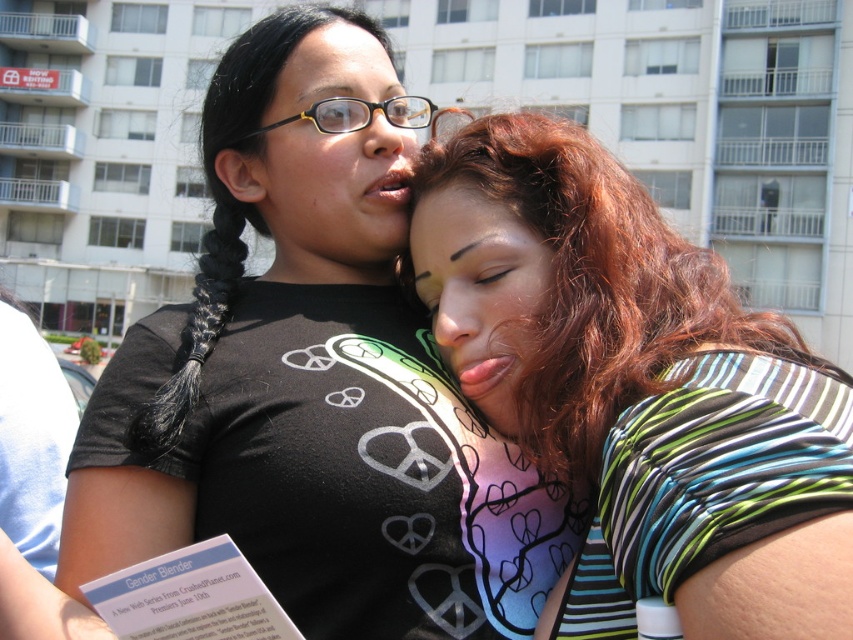
Image resolution: width=853 pixels, height=640 pixels. What do you see at coordinates (334, 192) in the screenshot?
I see `matte black glasses at upper center` at bounding box center [334, 192].

Is point (351, 216) in front of point (402, 60)?

Yes, it is.

I want to click on matte black glasses at upper center, so click(x=334, y=192).

In the scene shown: Which of these two, striped fabric shirt at center or matte skin face at center, stands taller?

With more height is matte skin face at center.

Does striped fabric shirt at center come behind matte skin face at center?

Yes, it is.

Is point (509, 394) behind point (468, 301)?

No, it is in front of (468, 301).

You are a GUI agent. You are given a task and a screenshot of the screen. Output one action in this format:
    pyautogui.click(x=<x>, y=<y>)
    Task: Click on the striped fabric shirt at center
    
    Given the screenshot: What is the action you would take?
    pyautogui.click(x=636, y=388)

Does striped fabric shirt at center appear over matte black glasses at upper center?

Actually, striped fabric shirt at center is below matte black glasses at upper center.

Is striped fabric shirt at center taller than matte black glasses at upper center?

No, striped fabric shirt at center is not taller than matte black glasses at upper center.

The image size is (853, 640). I want to click on striped fabric shirt at center, so click(636, 388).